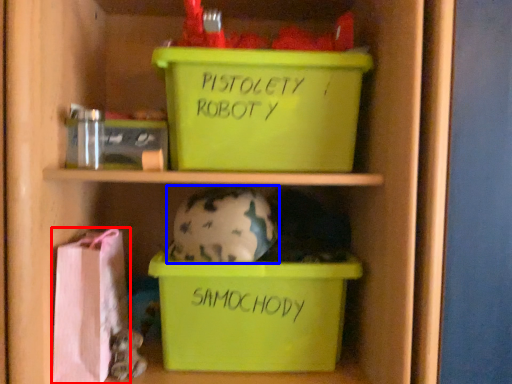
Question: Among these objects, which one is nearest to the camera, material (highlighted by a red box) or piggy bank (highlighted by a blue box)?

Choices:
 (A) material
 (B) piggy bank

Answer: (A)